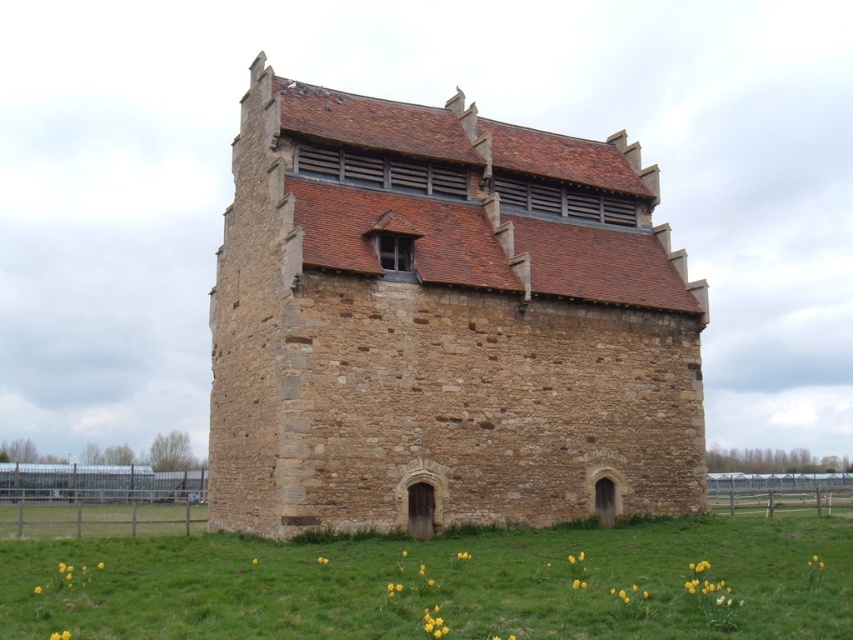
Based on the photo, which is above, brown stone tower at center or green grass at lower center?

brown stone tower at center

Can you confirm if brown stone tower at center is positioned above green grass at lower center?

Yes.

Is point (281, 196) positioned in front of point (57, 586)?

No, it is not.

This screenshot has height=640, width=853. In order to click on brown stone tower at center in this screenshot , I will do `click(444, 323)`.